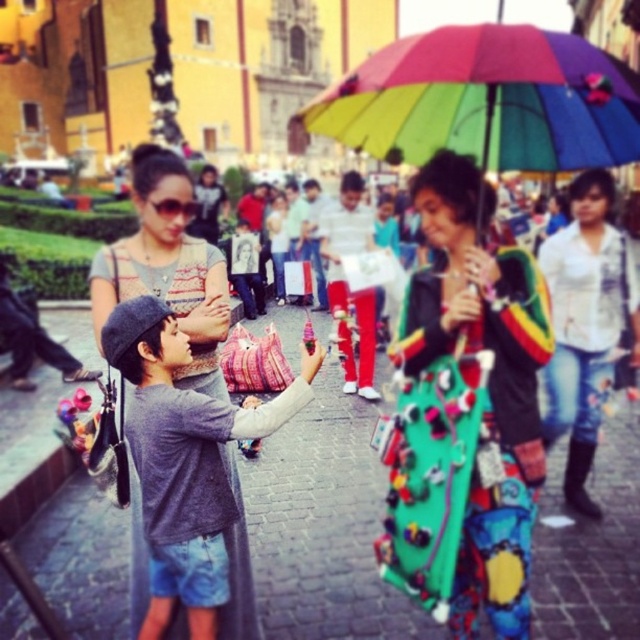
Where is `gray cotton shirt at center`? gray cotton shirt at center is located at coordinates (184, 454).

Which is more to the left, gray cotton shirt at center or matte gray sweater at center?

matte gray sweater at center is more to the left.

Which is behind, point (154, 621) or point (163, 246)?

Positioned behind is point (163, 246).

Where is `gray cotton shirt at center`? The image size is (640, 640). gray cotton shirt at center is located at coordinates (184, 454).

Between multicolored fabric umbrella at center and gray cotton shirt at center, which one is positioned lower?

gray cotton shirt at center is lower down.

Can you confirm if multicolored fabric umbrella at center is shorter than gray cotton shirt at center?

In fact, multicolored fabric umbrella at center may be taller than gray cotton shirt at center.

Is point (385, 544) farther from camera compared to point (150, 342)?

Yes, point (385, 544) is behind point (150, 342).

Locate an element on the screen. This screenshot has height=640, width=640. multicolored fabric umbrella at center is located at coordinates (465, 417).

Between multicolored fabric umbrella at center and matte gray sweater at center, which one is positioned higher?

matte gray sweater at center is above.

Does multicolored fabric umbrella at center have a lesser height compared to matte gray sweater at center?

Correct, multicolored fabric umbrella at center is not as tall as matte gray sweater at center.

The height and width of the screenshot is (640, 640). In order to click on multicolored fabric umbrella at center in this screenshot , I will do `click(465, 417)`.